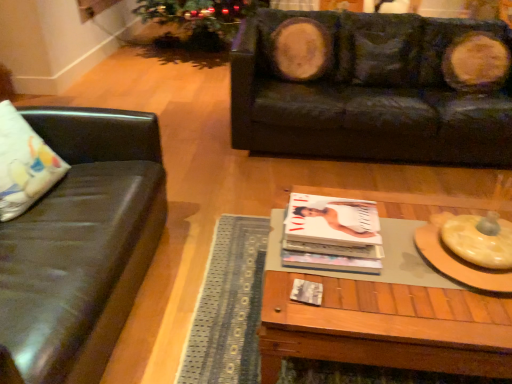
At what (x,y) coordinates should I click in order to perform the action: click on empty space that is to the right of matte white magazine at center. Please return your answer as a coordinate pair (x, y). The width and height of the screenshot is (512, 384). Looking at the image, I should click on (402, 251).